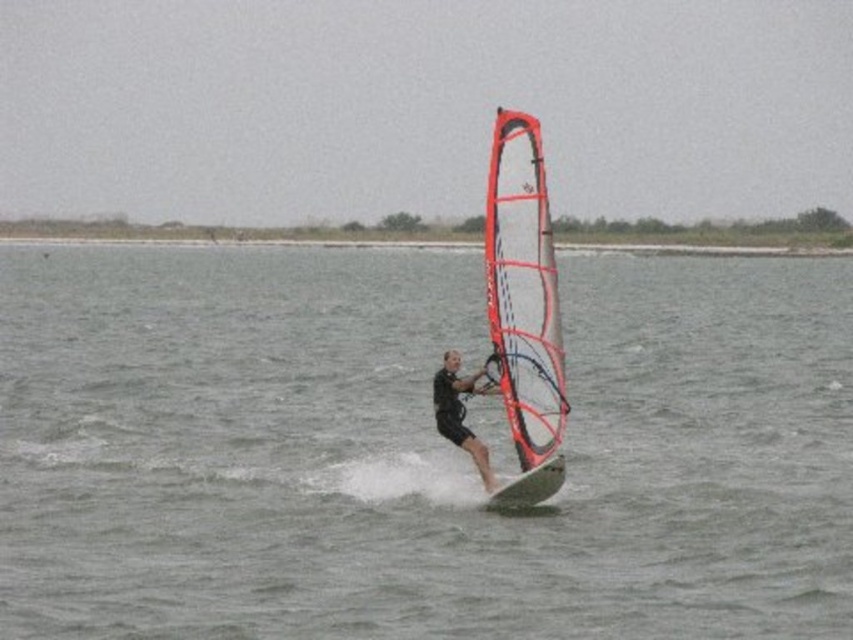
Question: In this image, where is transparent fabric sail at center located relative to black matte wetsuit at center?

Choices:
 (A) left
 (B) right

Answer: (B)

Question: Which of the following is the closest to the observer?

Choices:
 (A) transparent fabric sail at center
 (B) white matte surfboard at center
 (C) black matte wetsuit at center
 (D) clear water at center

Answer: (D)

Question: Is clear water at center to the right of white matte surfboard at center from the viewer's perspective?

Choices:
 (A) no
 (B) yes

Answer: (A)

Question: Is black matte wetsuit at center wider than white matte surfboard at center?

Choices:
 (A) yes
 (B) no

Answer: (B)

Question: Which of these objects is positioned farthest from the black matte wetsuit at center?

Choices:
 (A) white matte surfboard at center
 (B) clear water at center
 (C) transparent fabric sail at center

Answer: (B)

Question: Considering the real-world distances, which object is closest to the transparent fabric sail at center?

Choices:
 (A) clear water at center
 (B) white matte surfboard at center
 (C) black matte wetsuit at center

Answer: (B)